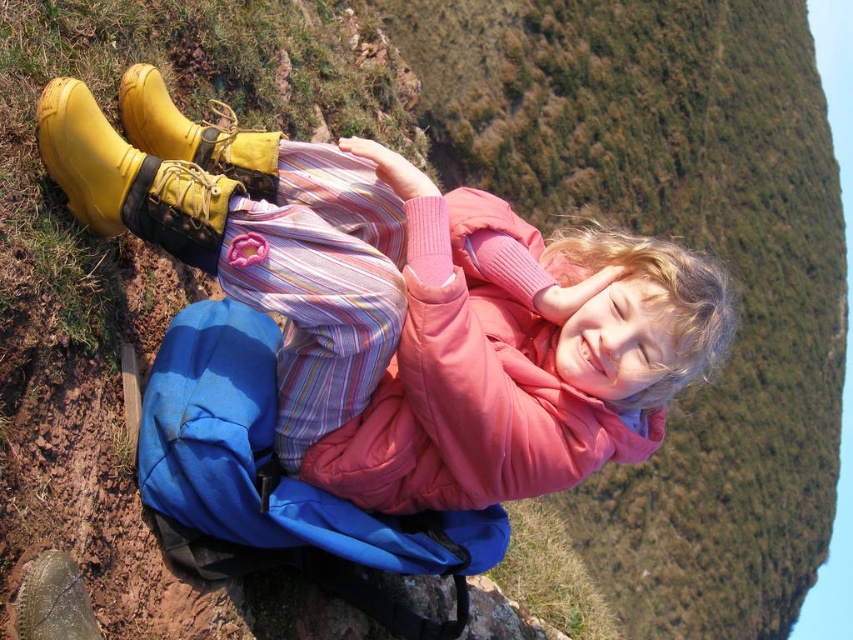
Does yellow rubber boot at left have a lesser width compared to rubber/yellow boot at left?

Yes, yellow rubber boot at left is thinner than rubber/yellow boot at left.

Between yellow rubber boot at left and rubber/yellow boot at left, which one has less height?

Standing shorter between the two is rubber/yellow boot at left.

Is point (100, 145) farther from camera compared to point (132, 116)?

No, (100, 145) is in front of (132, 116).

Where is `yellow rubber boot at left`? yellow rubber boot at left is located at coordinates (129, 179).

Based on the photo, how far apart are blue quilted sleeping bag at center and yellow rubber boot at left?

blue quilted sleeping bag at center is 5.02 feet away from yellow rubber boot at left.

Does blue quilted sleeping bag at center have a lesser height compared to yellow rubber boot at left?

In fact, blue quilted sleeping bag at center may be taller than yellow rubber boot at left.

Where is `blue quilted sleeping bag at center`? The width and height of the screenshot is (853, 640). blue quilted sleeping bag at center is located at coordinates (271, 460).

Is blue quilted sleeping bag at center shorter than rubber/yellow boot at left?

In fact, blue quilted sleeping bag at center may be taller than rubber/yellow boot at left.

I want to click on blue quilted sleeping bag at center, so pyautogui.click(x=271, y=460).

The height and width of the screenshot is (640, 853). What do you see at coordinates (271, 460) in the screenshot?
I see `blue quilted sleeping bag at center` at bounding box center [271, 460].

The width and height of the screenshot is (853, 640). I want to click on blue quilted sleeping bag at center, so click(271, 460).